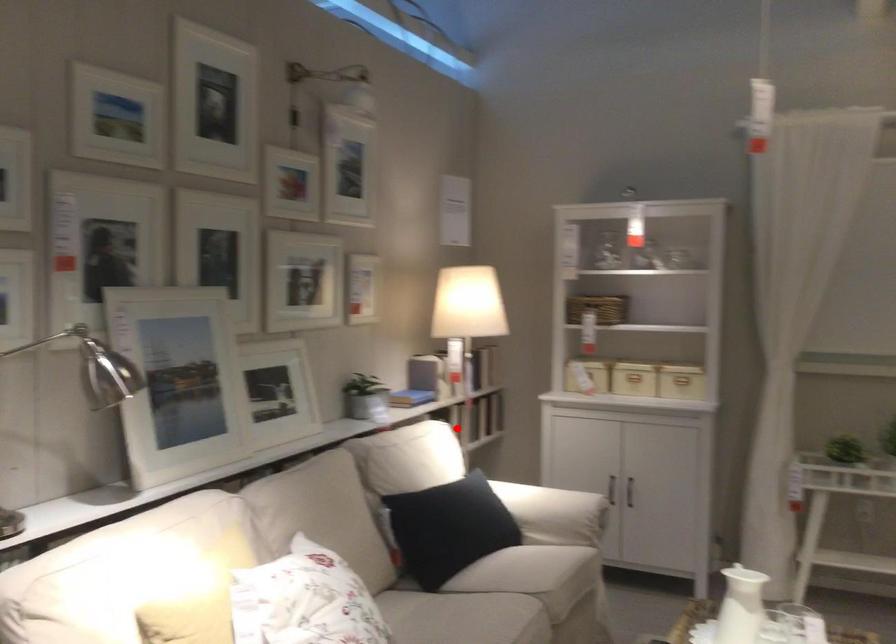
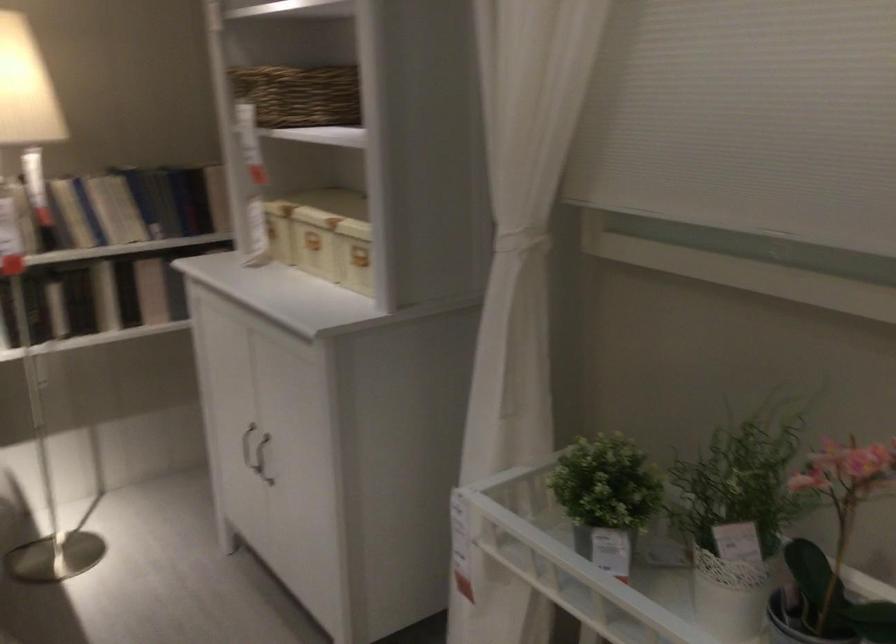
Question: I am providing you with two images of the same scene from different viewpoints. A red point is shown in image1. For the corresponding object point in image2, is it positioned nearer or farther from the camera?

Choices:
 (A) Nearer
 (B) Farther

Answer: (A)